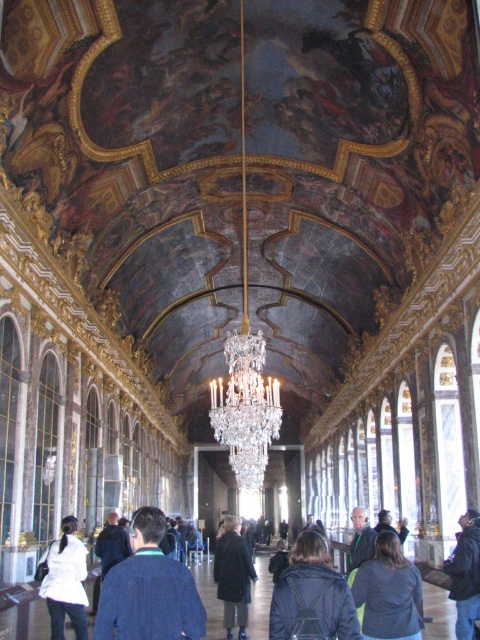
Does white matte coat at center have a greater height compared to green fabric coat at center?

In fact, white matte coat at center may be shorter than green fabric coat at center.

Does point (46, 595) lie behind point (351, 516)?

No, (46, 595) is closer to viewer.

Identify the location of white matte coat at center. The height and width of the screenshot is (640, 480). (66, 580).

Is clear crystal chandelier at center shorter than dark gray jacket at lower center?

No.

The width and height of the screenshot is (480, 640). What do you see at coordinates (245, 406) in the screenshot?
I see `clear crystal chandelier at center` at bounding box center [245, 406].

At what (x,y) coordinates should I click in order to perform the action: click on clear crystal chandelier at center. Please return your answer as a coordinate pair (x, y). The image size is (480, 640). Looking at the image, I should click on (245, 406).

Does point (230, 625) lie in front of point (476, 614)?

No, (230, 625) is behind (476, 614).

Can you confirm if dark blue coat at center is positioned to the right of black leather jacket at lower right?

No, dark blue coat at center is not to the right of black leather jacket at lower right.

The width and height of the screenshot is (480, 640). Find the location of `dark blue coat at center`. dark blue coat at center is located at coordinates (233, 577).